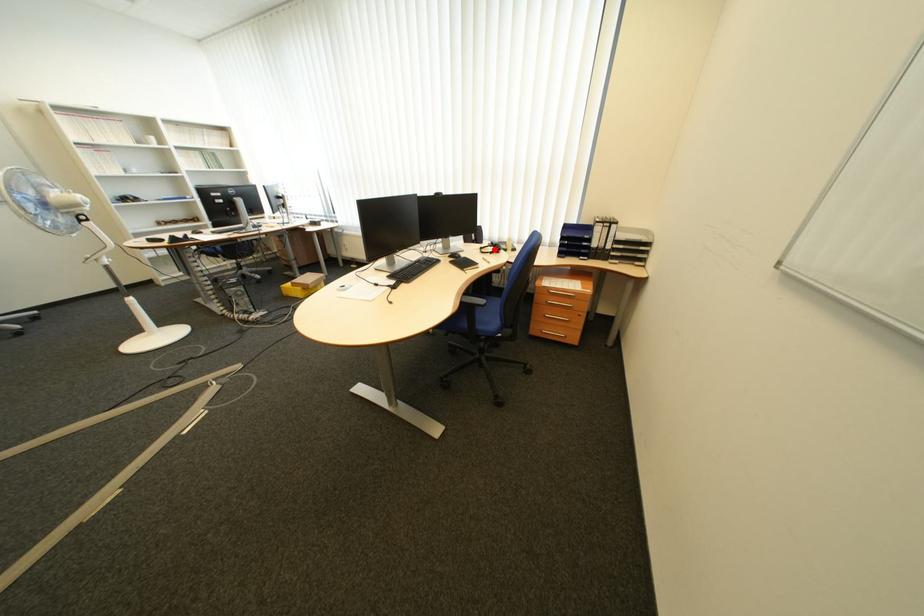
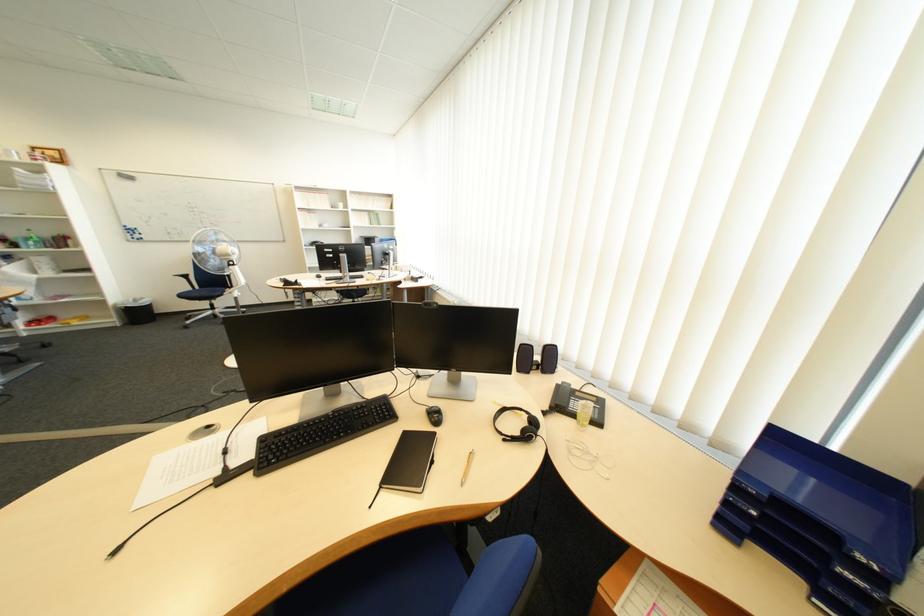
Question: A red point is marked in image1. In image2, is the corresponding 3D point closer to the camera or farther? Reply with the corresponding letter.

Choices:
 (A) The corresponding 3D point is closer.
 (B) The corresponding 3D point is farther.

Answer: (B)